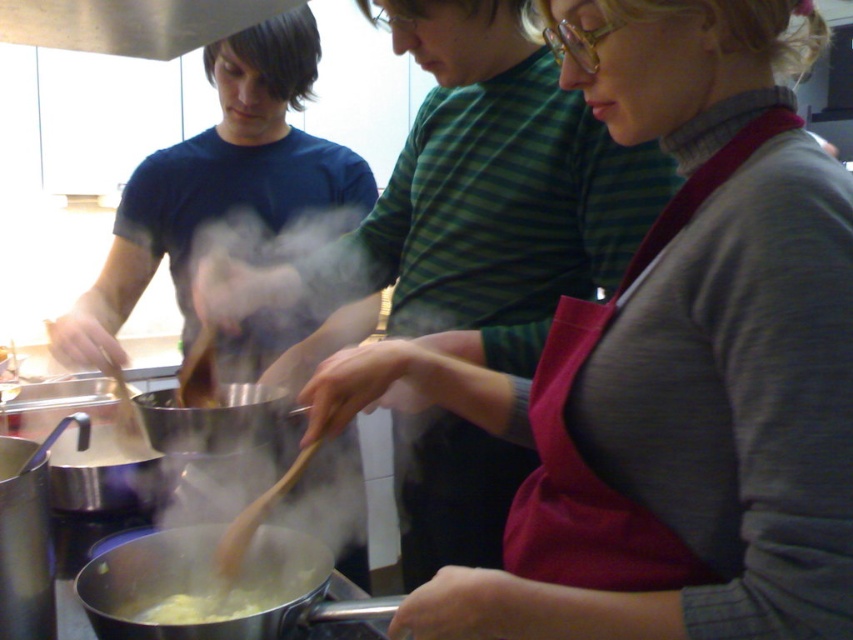
Question: In this image, where is shiny silver pot at center located relative to yellow creamy pasta at lower center?

Choices:
 (A) above
 (B) below

Answer: (A)

Question: Which point appears closest to the camera in this image?

Choices:
 (A) (206, 611)
 (B) (241, 381)
 (C) (315, 547)

Answer: (A)

Question: Among these points, which one is farthest from the camera?

Choices:
 (A) (183, 579)
 (B) (199, 621)

Answer: (A)

Question: Estimate the real-world distances between objects in this image. Which object is farther from the yellow creamy pasta at lower center?

Choices:
 (A) shiny silver pot at center
 (B) stainless steel pot at lower center

Answer: (A)

Question: Is stainless steel pot at lower center closer to camera compared to shiny silver pot at center?

Choices:
 (A) no
 (B) yes

Answer: (B)

Question: Is stainless steel pot at lower center smaller than shiny silver pot at center?

Choices:
 (A) yes
 (B) no

Answer: (B)